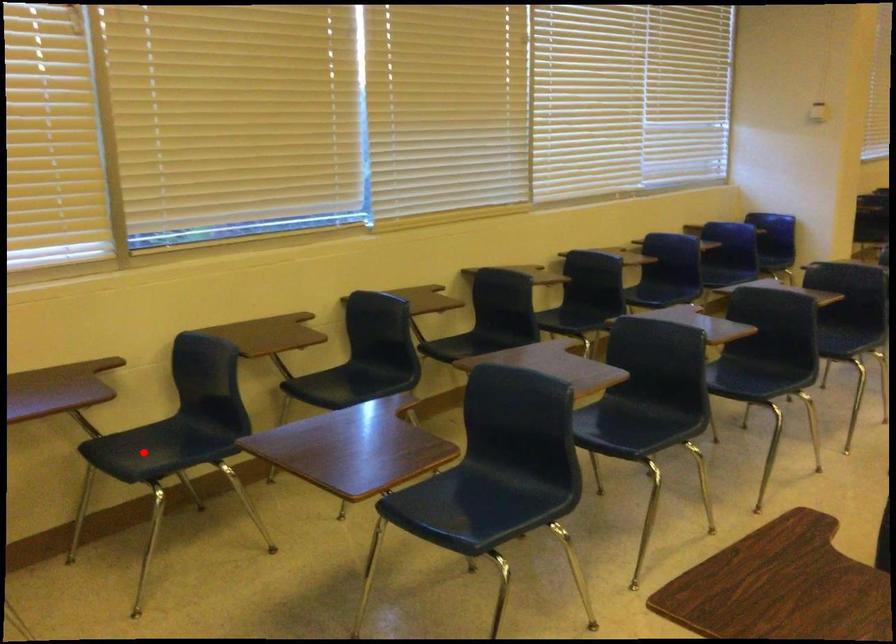
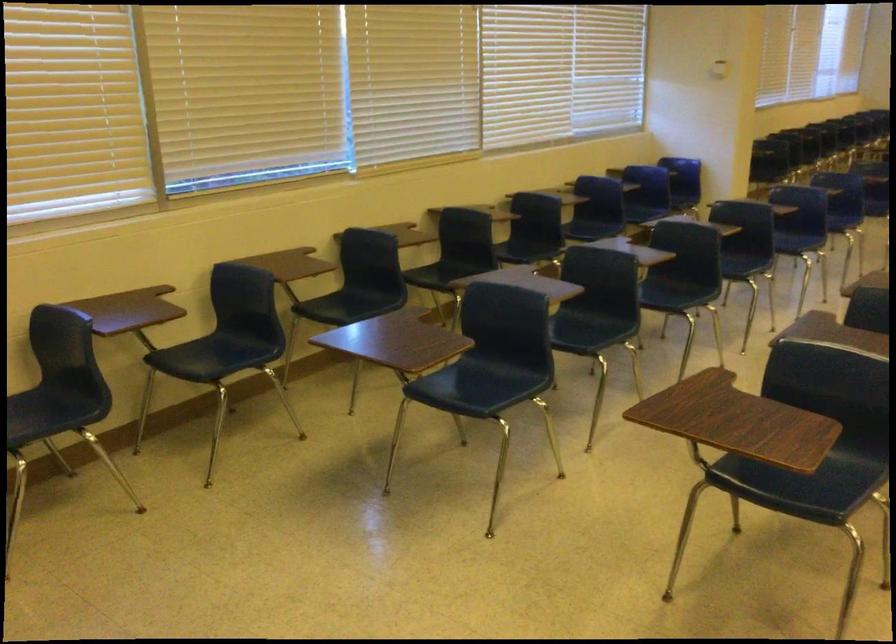
The point at the highlighted location is marked in the first image. Where is the corresponding point in the second image?

(196, 359)